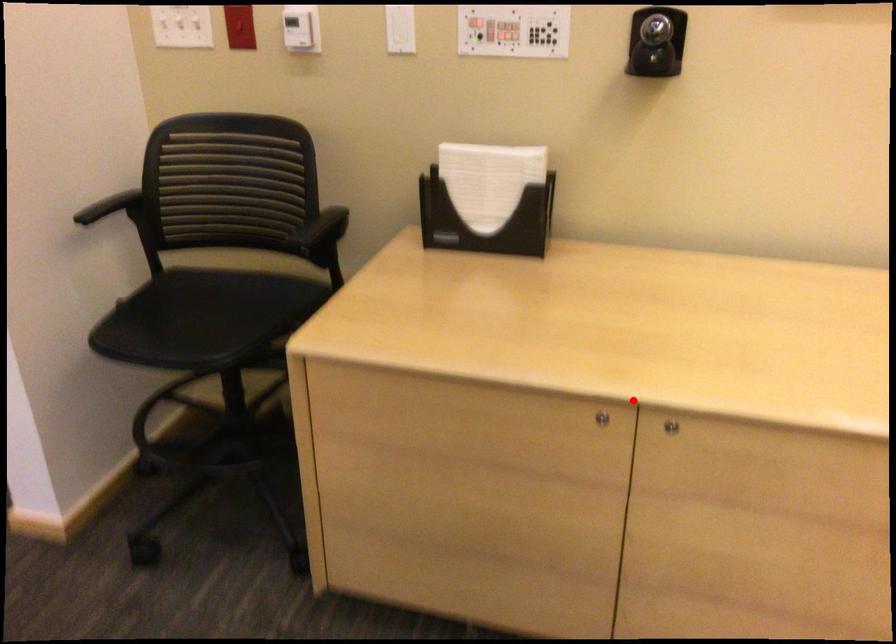
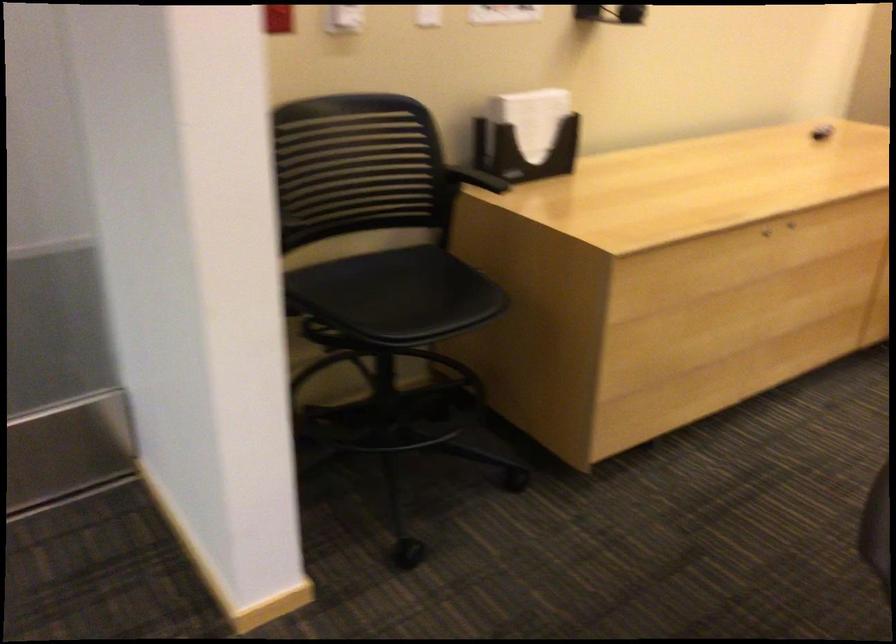
In the second image, find the point that corresponds to the highlighted location in the first image.

(765, 232)